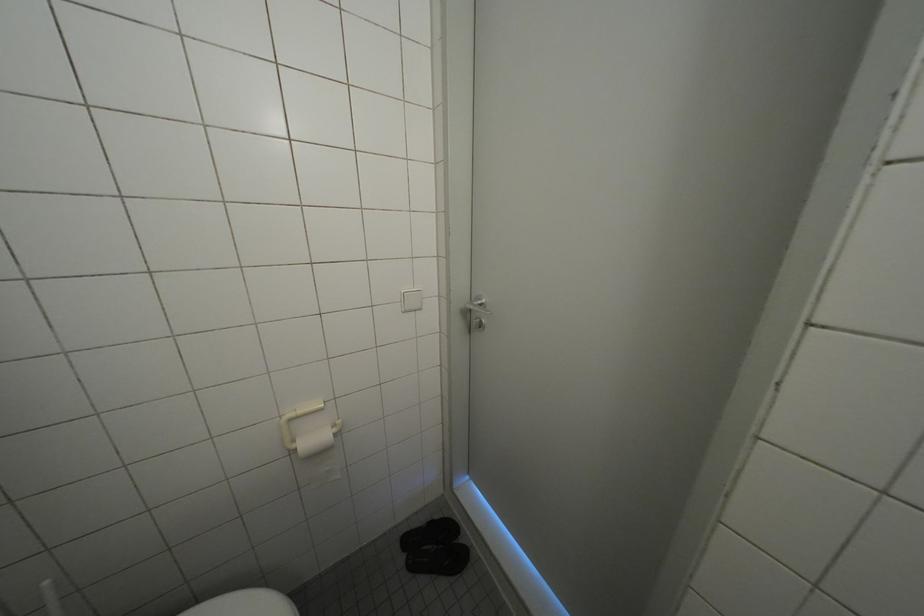
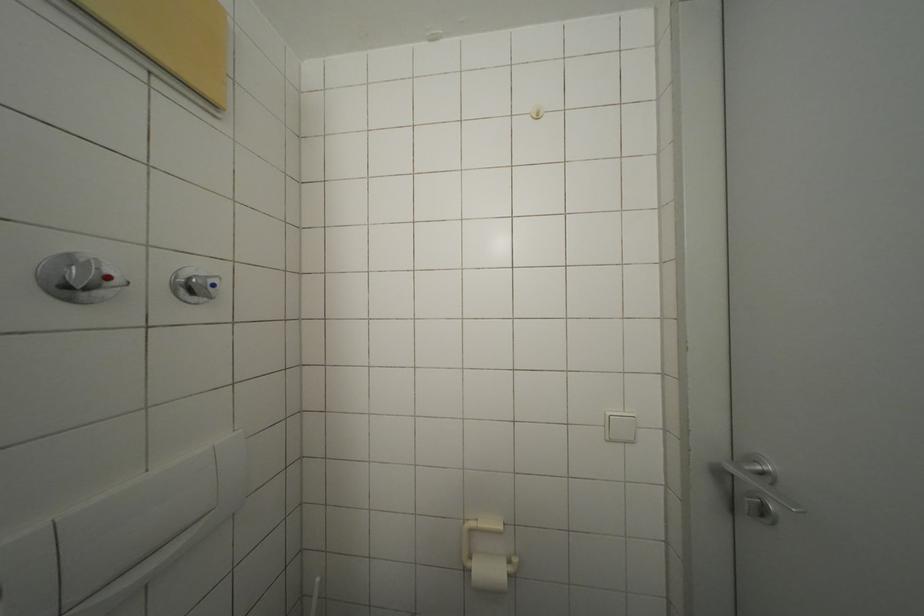
Question: The images are taken continuously from a first-person perspective. In which direction is your viewpoint rotating?

Choices:
 (A) Left
 (B) Right
 (C) Up
 (D) Down

Answer: (A)